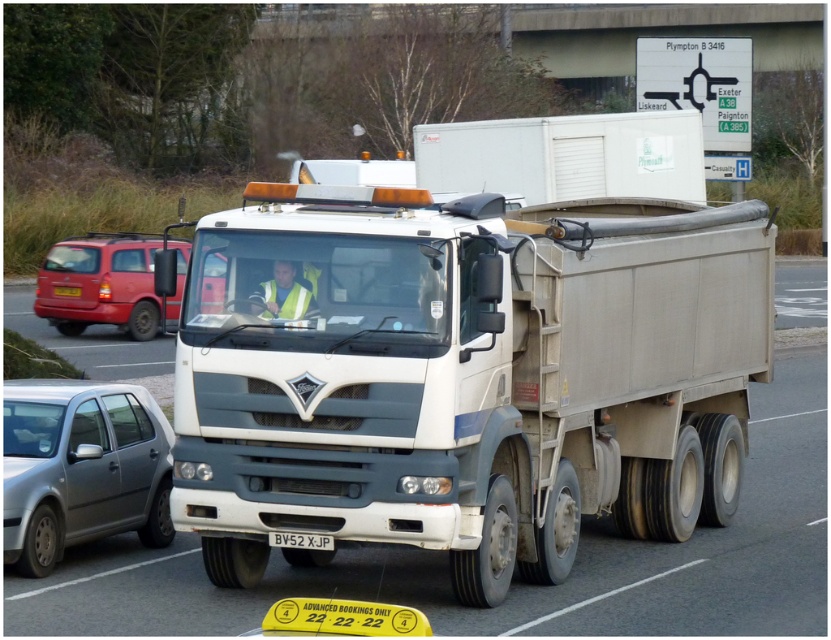
Question: Which object appears farthest from the camera in this image?

Choices:
 (A) white matte trailer truck at center
 (B) matte red van at left
 (C) white plastic license plate at center

Answer: (C)

Question: Which object is the farthest from the satin silver car at lower left?

Choices:
 (A) matte red van at left
 (B) white plastic license plate at center

Answer: (A)

Question: Which object is the farthest from the white matte trailer truck at center?

Choices:
 (A) black plastic license plate at center
 (B) satin silver car at lower left
 (C) white plastic license plate at center
 (D) matte red van at left

Answer: (A)

Question: Is satin silver car at lower left smaller than matte red van at left?

Choices:
 (A) yes
 (B) no

Answer: (A)

Question: Is white matte trailer truck at center above matte red van at left?

Choices:
 (A) yes
 (B) no

Answer: (B)

Question: Does matte red van at left appear on the right side of black plastic license plate at center?

Choices:
 (A) yes
 (B) no

Answer: (A)